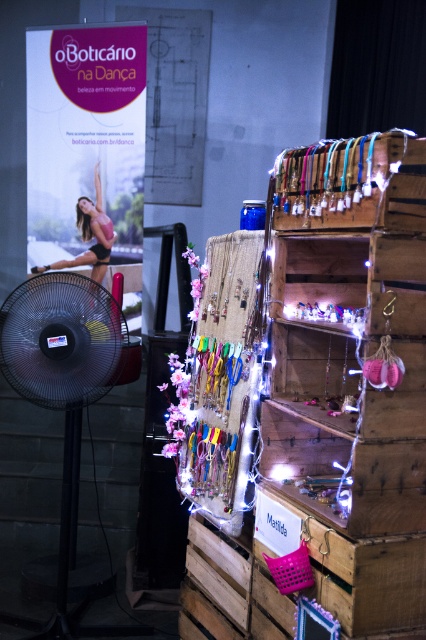
Between black plastic mechanical fan at left and matte black bikini at center, which one has less height?

matte black bikini at center

At what (x,y) coordinates should I click in order to perform the action: click on black plastic mechanical fan at left. Please return your answer as a coordinate pair (x, y). Image resolution: width=426 pixels, height=640 pixels. Looking at the image, I should click on (63, 396).